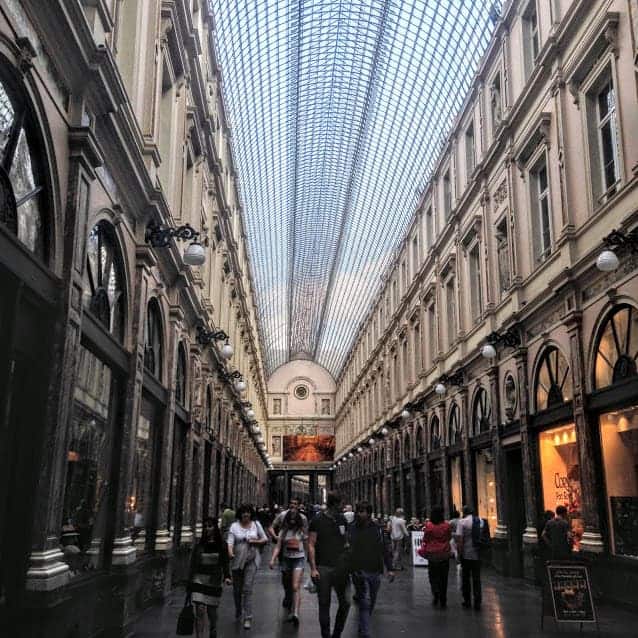
At what (x,y) coordinates should I click in order to perform the action: click on poster. Please return your answer as a coordinate pair (x, y). The image size is (638, 638). Looking at the image, I should click on (582, 604).